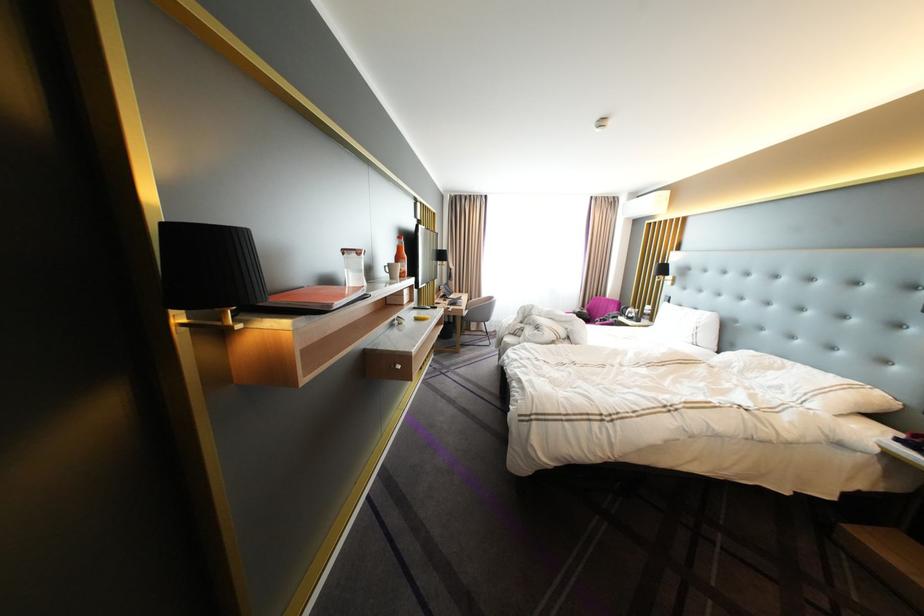
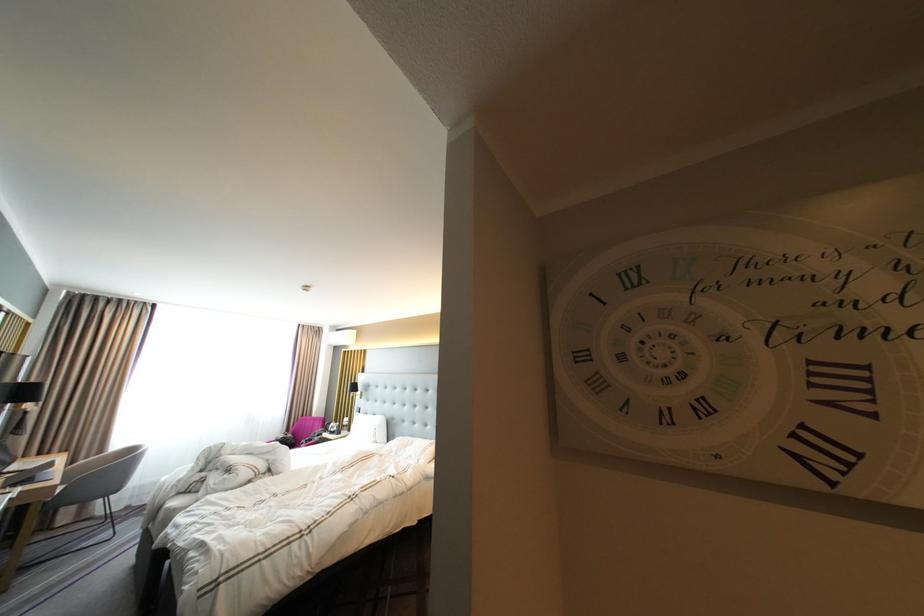
The point at [456,251] is marked in the first image. Where is the corresponding point in the second image?

(43, 381)